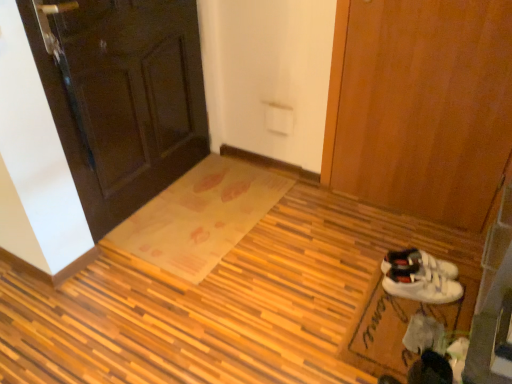
Question: Is translucent plastic doormat at center, placed as the second doormat when sorted from right to left, to the right of white suede sneakers at lower right from the viewer's perspective?

Choices:
 (A) no
 (B) yes

Answer: (A)

Question: Is the depth of translucent plastic doormat at center, which ranks as the 1th doormat in back-to-front order, greater than that of white suede sneakers at lower right?

Choices:
 (A) no
 (B) yes

Answer: (B)

Question: From a real-world perspective, is translucent plastic doormat at center, placed as the second doormat when sorted from right to left, positioned over white suede sneakers at lower right based on gravity?

Choices:
 (A) no
 (B) yes

Answer: (A)

Question: Is translucent plastic doormat at center, the 1th doormat when ordered from left to right, beside white suede sneakers at lower right?

Choices:
 (A) yes
 (B) no

Answer: (B)

Question: Is white suede sneakers at lower right a part of translucent plastic doormat at center, placed as the second doormat when sorted from right to left?

Choices:
 (A) yes
 (B) no

Answer: (B)

Question: Could you tell me if translucent plastic doormat at center, which ranks as the 1th doormat in back-to-front order, is facing white suede sneakers at lower right?

Choices:
 (A) no
 (B) yes

Answer: (A)

Question: Does translucent plastic doormat at center, placed as the second doormat when sorted from right to left, appear on the left side of dark wood door at upper left, the 1th door from the left?

Choices:
 (A) yes
 (B) no

Answer: (B)

Question: Is translucent plastic doormat at center, the 2th doormat in the front-to-back sequence, smaller than dark wood door at upper left, placed as the second door when sorted from right to left?

Choices:
 (A) no
 (B) yes

Answer: (B)

Question: From the image's perspective, is translucent plastic doormat at center, the 2th doormat in the front-to-back sequence, over dark wood door at upper left, the 1th door from the left?

Choices:
 (A) yes
 (B) no

Answer: (B)

Question: From the image's perspective, would you say translucent plastic doormat at center, placed as the second doormat when sorted from right to left, is shown under dark wood door at upper left, the 1th door from the left?

Choices:
 (A) no
 (B) yes

Answer: (B)

Question: Does translucent plastic doormat at center, placed as the second doormat when sorted from right to left, come in front of dark wood door at upper left, placed as the second door when sorted from right to left?

Choices:
 (A) no
 (B) yes

Answer: (A)

Question: Does translucent plastic doormat at center, placed as the second doormat when sorted from right to left, touch dark wood door at upper left, placed as the second door when sorted from right to left?

Choices:
 (A) no
 (B) yes

Answer: (A)

Question: Does dark wood door at upper left, the 1th door from the left, have a larger size compared to translucent plastic doormat at center, which ranks as the 1th doormat in back-to-front order?

Choices:
 (A) yes
 (B) no

Answer: (A)